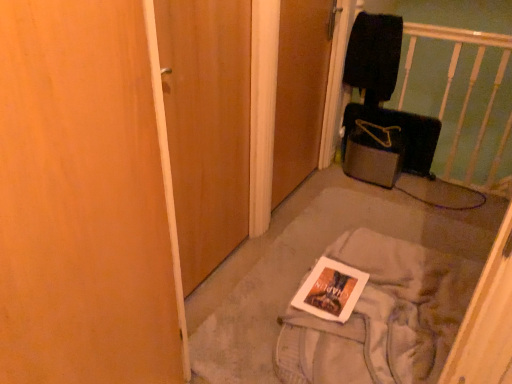
Find the location of a particular element. free space between wooden door at center, the 1th door when ordered from left to right, and white fabric book at center is located at coordinates (263, 249).